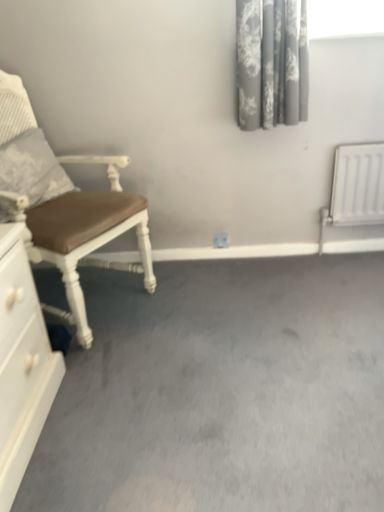
This screenshot has height=512, width=384. What are the coordinates of `vacant area situated below brown leather chair at left (from a real-world perspective)` in the screenshot? It's located at (91, 297).